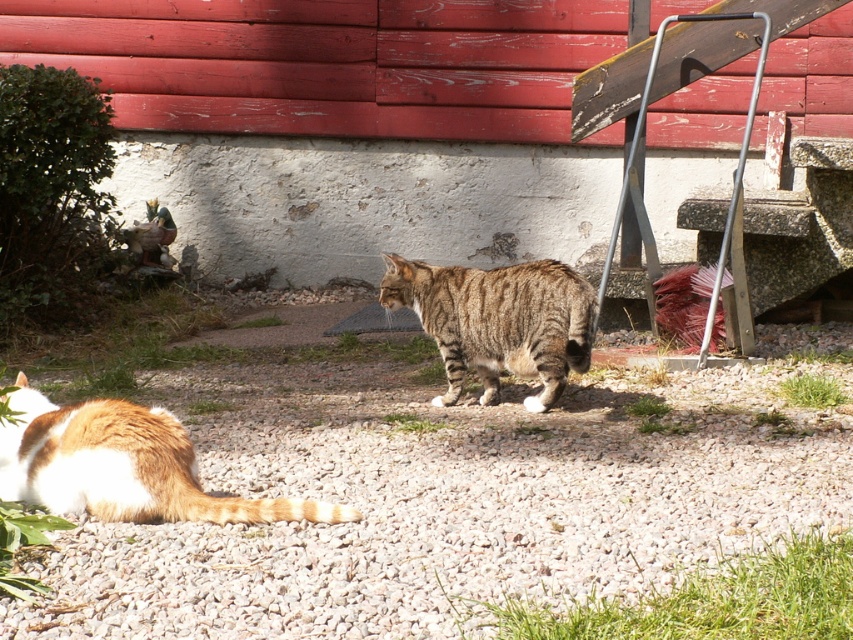
Question: Which point is farther to the camera?

Choices:
 (A) orange-white fur cat at lower left
 (B) tabby fur cat at center
 (C) gray gravel at center

Answer: (B)

Question: Can you confirm if orange-white fur cat at lower left is smaller than tabby fur cat at center?

Choices:
 (A) no
 (B) yes

Answer: (B)

Question: Which point is closer to the camera taking this photo?

Choices:
 (A) (523, 545)
 (B) (456, 388)

Answer: (A)

Question: Does gray gravel at center appear under orange-white fur cat at lower left?

Choices:
 (A) yes
 (B) no

Answer: (B)

Question: Does gray gravel at center have a greater width compared to orange-white fur cat at lower left?

Choices:
 (A) yes
 (B) no

Answer: (A)

Question: Considering the real-world distances, which object is closest to the gray gravel at center?

Choices:
 (A) orange-white fur cat at lower left
 (B) tabby fur cat at center

Answer: (B)